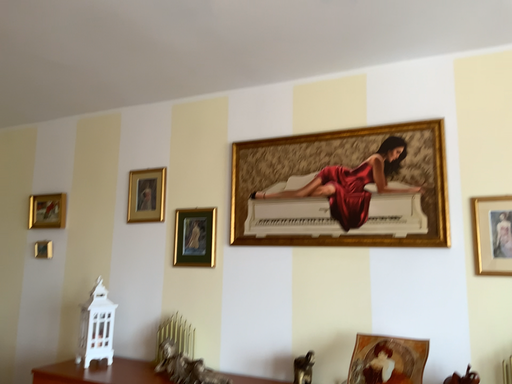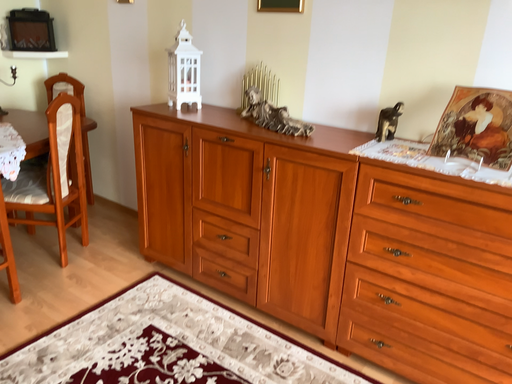
Question: How did the camera likely rotate when shooting the video?

Choices:
 (A) rotated downward
 (B) rotated upward

Answer: (A)